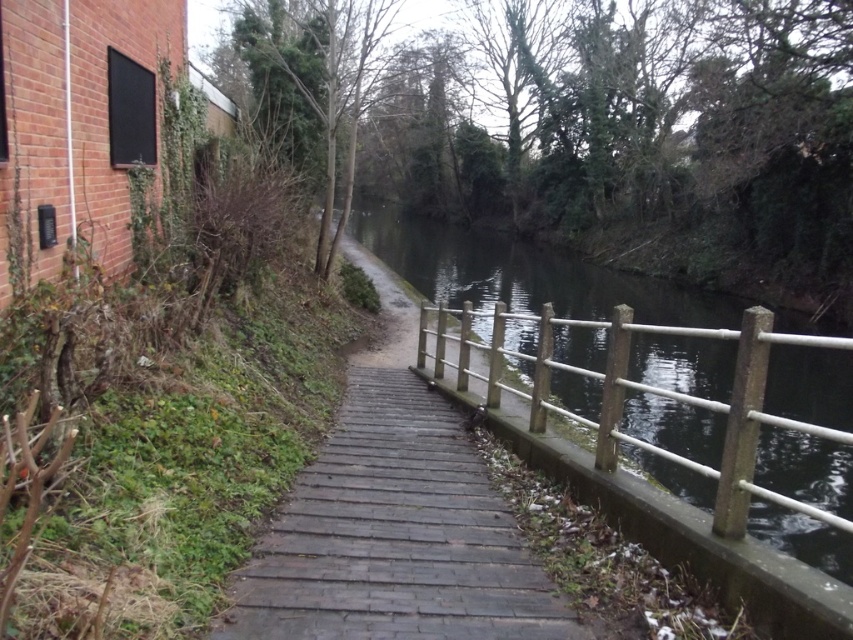
Is wooden planks at center taller than wooden rail at center?

No.

This screenshot has width=853, height=640. Describe the element at coordinates (393, 522) in the screenshot. I see `wooden planks at center` at that location.

Who is more distant from viewer, (393, 344) or (618, 317)?

Positioned behind is point (393, 344).

You are a GUI agent. You are given a task and a screenshot of the screen. Output one action in this format:
    pyautogui.click(x=<x>, y=<y>)
    Task: Click on the wooden planks at center
    The height and width of the screenshot is (640, 853).
    Given the screenshot: What is the action you would take?
    pyautogui.click(x=393, y=522)